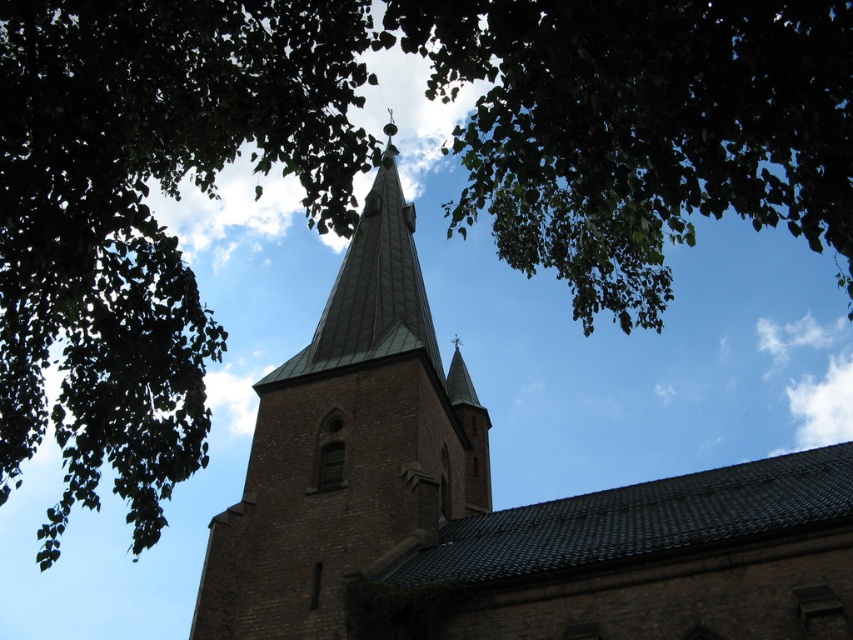
You are standing in front of a church and see the brown brick church steeple at center and the brown brick tower at center. Which structure is closer to you?

The brown brick church steeple at center is closer to the viewer than the brown brick tower at center.

You are a bird flying near the brown brick church steeple at center and the green leafy branches at upper center. If you want to land on the closer object, which one should you choose?

The brown brick church steeple at center is closer to you than the green leafy branches at upper center, so you should land on the brown brick church steeple at center.

You are standing in front of the church steeple and notice the green leafy branches at upper center and the brown brick tower at center. Which object is nearer to you?

The green leafy branches at upper center are closer to the viewer than the brown brick tower at center.